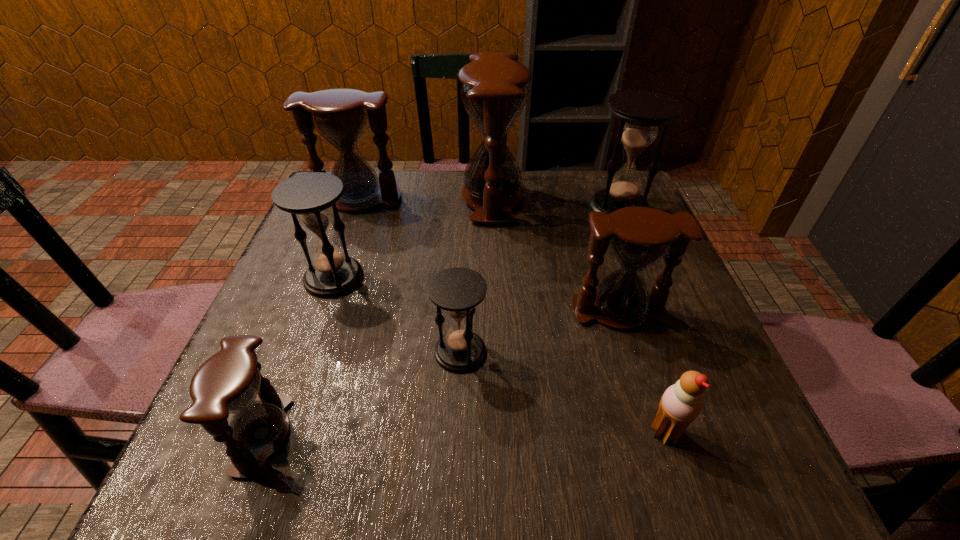
The width and height of the screenshot is (960, 540). Identify the location of free point located 0.060m on the right of the nearest brown hourglass. (328, 436).

The width and height of the screenshot is (960, 540). I want to click on free space located 0.130m at the front with a straw on the icecream, so [564, 432].

Locate an element on the screen. The width and height of the screenshot is (960, 540). free location located at the front with a straw on the icecream is located at coordinates (597, 432).

I want to click on vacant space situated at the front with a straw on the icecream, so click(x=506, y=432).

Where is `hourglass present at the near edge`? Image resolution: width=960 pixels, height=540 pixels. hourglass present at the near edge is located at coordinates (228, 382).

This screenshot has height=540, width=960. Find the location of `icecream that is at the near edge`. icecream that is at the near edge is located at coordinates [681, 403].

The image size is (960, 540). Find the location of `icecream that is at the right edge`. icecream that is at the right edge is located at coordinates (681, 403).

I want to click on object that is at the far left corner, so click(x=340, y=115).

Locate an element on the screen. The width and height of the screenshot is (960, 540). object that is positioned at the near left corner is located at coordinates (228, 382).

I want to click on object that is positioned at the far right corner, so click(640, 112).